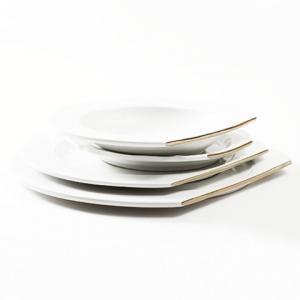
What are the coordinates of `stacked dishes with slices missing to show inside material and texture` in the screenshot? It's located at (163, 139), (170, 163), (151, 188), (148, 207).